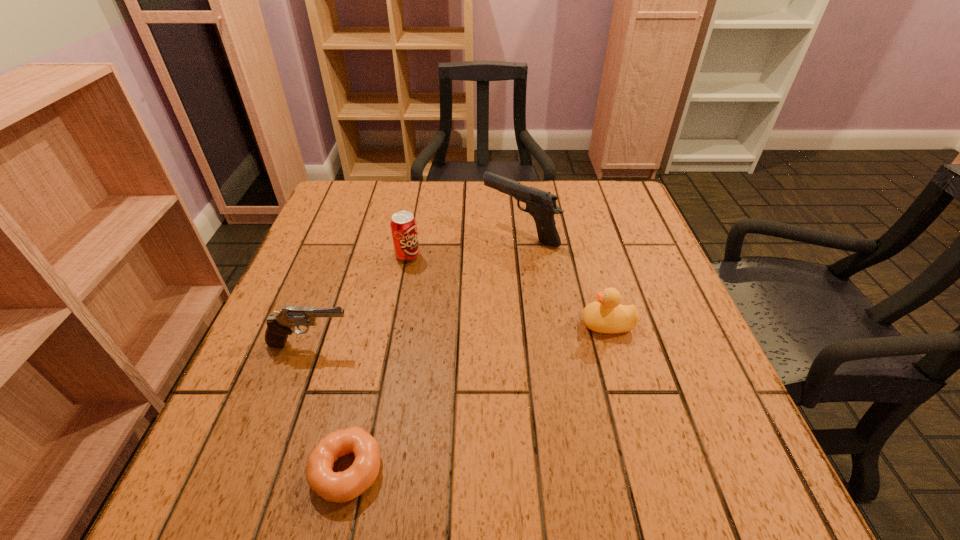
I want to click on vacant space positioned 0.340m at the muzzle of the fourth object from left to right, so click(x=349, y=232).

I want to click on vacant area located on the back of the soda, so click(x=418, y=206).

I want to click on vacant region located at the barrel of the fourth farthest object, so click(x=430, y=345).

You are a GUI agent. You are given a task and a screenshot of the screen. Output one action in this format:
    pyautogui.click(x=<x>, y=<y>)
    Task: Click on the free space located 0.360m on the face of the third nearest object
    
    Given the screenshot: What is the action you would take?
    pyautogui.click(x=403, y=324)

At what (x,y) coordinates should I click in order to perform the action: click on vacant region located on the face of the third nearest object. Please return your answer as a coordinate pair (x, y). Looking at the image, I should click on (488, 324).

Find the location of a particular element. Image resolution: width=960 pixels, height=540 pixels. vacant region located on the face of the third nearest object is located at coordinates (532, 324).

In order to click on vacant area situated on the left of the shortest object in this screenshot , I will do `click(226, 470)`.

Where is `object at the far edge`? object at the far edge is located at coordinates (541, 205).

The height and width of the screenshot is (540, 960). I want to click on object located in the near edge section of the desktop, so tap(340, 487).

This screenshot has width=960, height=540. Find the location of `object that is at the left edge`. object that is at the left edge is located at coordinates (279, 326).